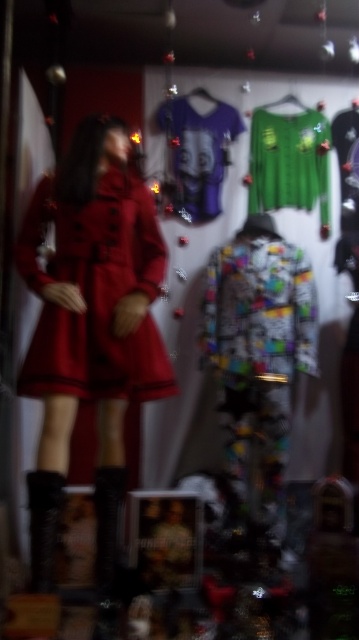
Between green matte sweater at upper center and purple jersey at center, which one is positioned lower?

Positioned lower is green matte sweater at upper center.

Image resolution: width=359 pixels, height=640 pixels. I want to click on green matte sweater at upper center, so click(290, 161).

Consider the image. Is matte red coat at center smaller than purple jersey at center?

Incorrect, matte red coat at center is not smaller in size than purple jersey at center.

Does matte red coat at center appear on the left side of purple jersey at center?

Indeed, matte red coat at center is positioned on the left side of purple jersey at center.

Is point (109, 252) more distant than point (196, 202)?

No, (109, 252) is in front of (196, 202).

Identify the location of matte red coat at center. The height and width of the screenshot is (640, 359). (95, 292).

Which of these two, matte red coat at center or green matte sweater at upper center, stands shorter?

green matte sweater at upper center is shorter.

The width and height of the screenshot is (359, 640). What do you see at coordinates (95, 292) in the screenshot?
I see `matte red coat at center` at bounding box center [95, 292].

Where is `matte red coat at center`? This screenshot has height=640, width=359. matte red coat at center is located at coordinates (95, 292).